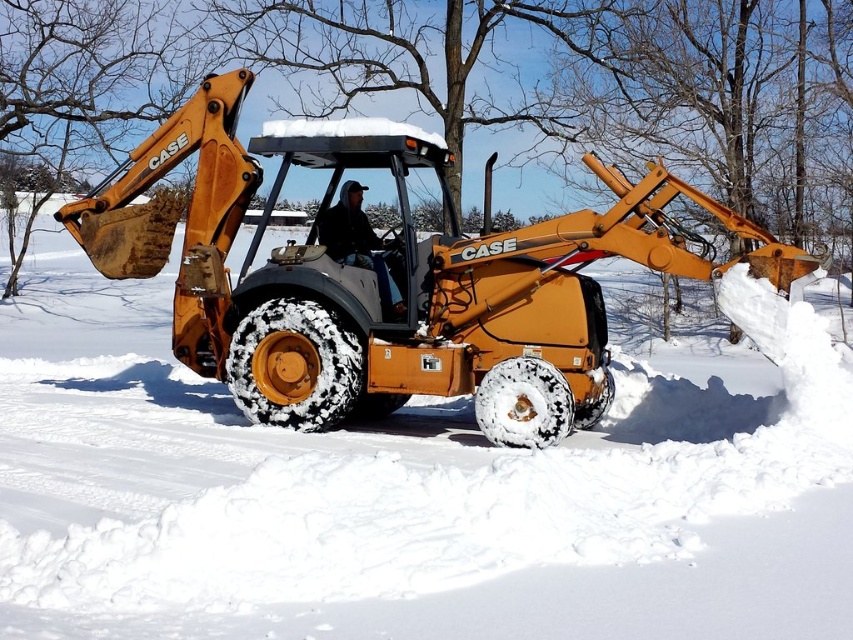
Question: From the image, what is the correct spatial relationship of matte yellow tractor at center in relation to dark blue jeans at center?

Choices:
 (A) right
 (B) left

Answer: (A)

Question: Among these points, which one is farthest from the camera?

Choices:
 (A) (576, 413)
 (B) (347, 260)

Answer: (B)

Question: Which object is closer to the camera taking this photo?

Choices:
 (A) dark blue jeans at center
 (B) matte yellow tractor at center

Answer: (B)

Question: Can you confirm if matte yellow tractor at center is wider than dark blue jeans at center?

Choices:
 (A) yes
 (B) no

Answer: (B)

Question: Can you confirm if matte yellow tractor at center is positioned to the left of dark blue jeans at center?

Choices:
 (A) no
 (B) yes

Answer: (A)